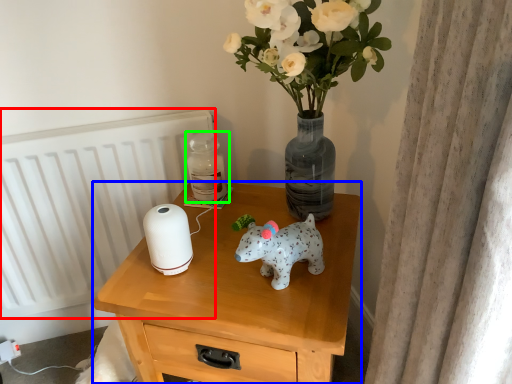
Question: Based on their relative distances, which object is farther from radiator (highlighted by a red box)? Choose from nightstand (highlighted by a blue box) and bottle (highlighted by a green box).

Choices:
 (A) nightstand
 (B) bottle

Answer: (A)